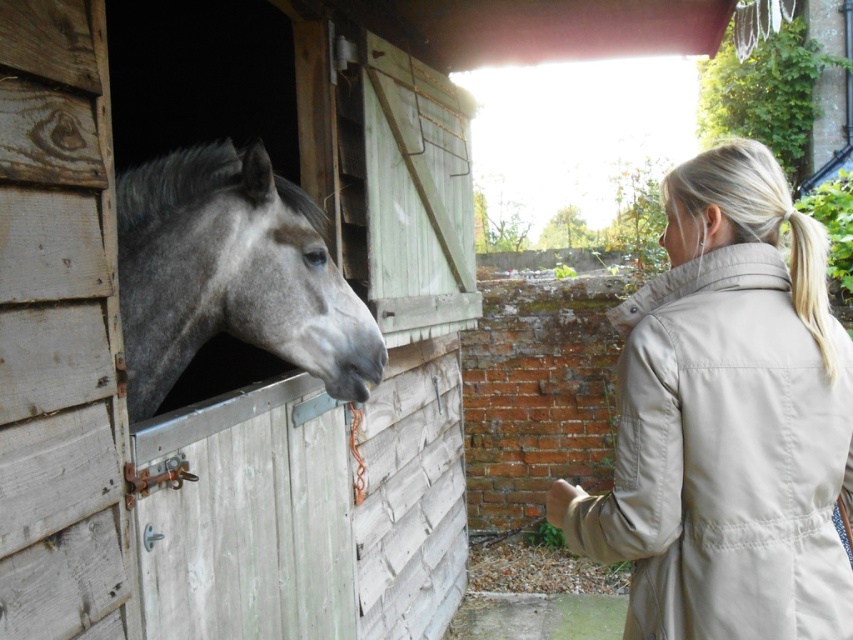
You are standing at the center of the stable and want to find the beige fabric trench coat at right. According to the coordinates provided, in which direction should you move to locate it?

The beige fabric trench coat at right is located at coordinates point (724, 458). Since you are at the center, you should move towards the right and slightly upwards to reach it.

Looking at this image, based on the coordinates provided, which object is located at point (231, 275) in the scene?

The gray matte horse at left is located at point (231, 275).

You are designing a poster for an animal sanctuary and need to highlight the size difference between the gray matte horse at left and the blonde hair at upper right. Which object should you emphasize as bigger?

The gray matte horse at left is larger in size than the blonde hair at upper right, so you should emphasize the gray matte horse at left as the bigger object.